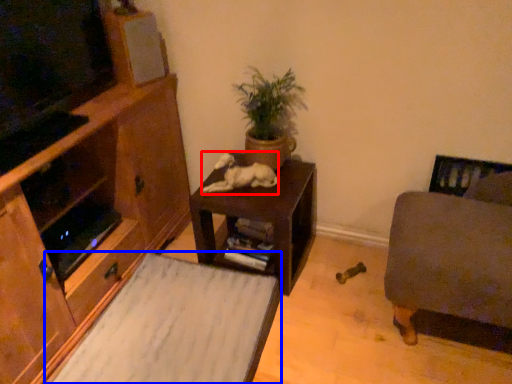
Question: Which point is closer to the camera, animal (highlighted by a red box) or plain (highlighted by a blue box)?

Choices:
 (A) animal
 (B) plain

Answer: (B)